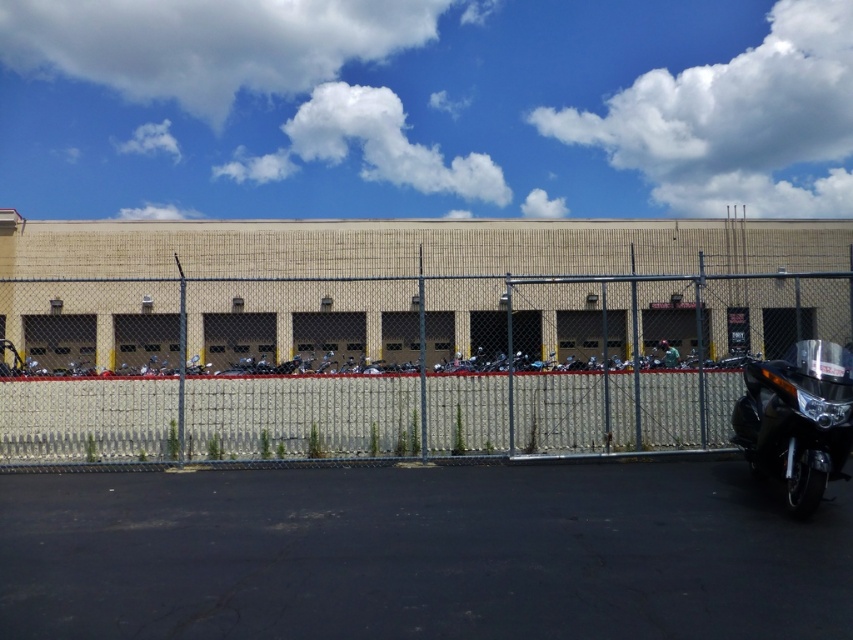
Who is more forward, (399, 404) or (793, 352)?

Point (793, 352) is in front.

Who is higher up, metallic chain-link fence at center or glossy black motorcycle at lower right?

Positioned higher is metallic chain-link fence at center.

At what (x,y) coordinates should I click in order to perform the action: click on metallic chain-link fence at center. Please return your answer as a coordinate pair (x, y). Image resolution: width=853 pixels, height=640 pixels. Looking at the image, I should click on (389, 400).

The image size is (853, 640). Find the location of `metallic chain-link fence at center`. metallic chain-link fence at center is located at coordinates (389, 400).

Between black asphalt at lower center and glossy black motorcycle at lower right, which one has more height?

Standing taller between the two is glossy black motorcycle at lower right.

Who is shorter, black asphalt at lower center or glossy black motorcycle at lower right?

black asphalt at lower center is shorter.

Locate an element on the screen. This screenshot has width=853, height=640. black asphalt at lower center is located at coordinates (421, 554).

At what (x,y) coordinates should I click in order to perform the action: click on black asphalt at lower center. Please return your answer as a coordinate pair (x, y). Looking at the image, I should click on (421, 554).